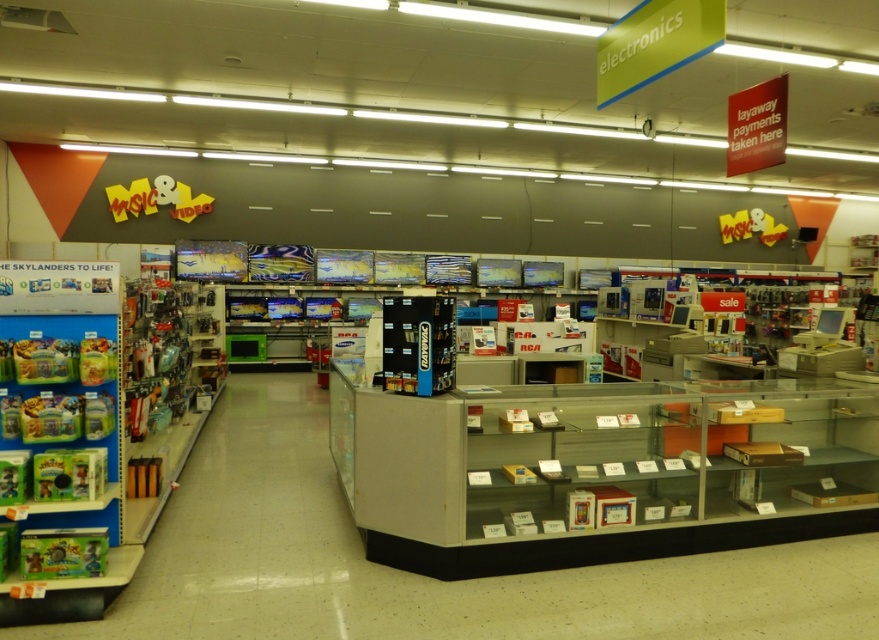
You are a customer in the electronics store looking for a gift. You see the clear plastic display case at center and the green plastic toy at left. Which item is taller?

The green plastic toy at left is taller than the clear plastic display case at center.

You are a customer in the electronics store and want to pick up both the clear plastic display case at center and the green plastic toy at left. Which item will you need to reach for first as you approach the store from the entrance?

You will need to reach for the clear plastic display case at center first because it is closer to you than the green plastic toy at left, which is further away.